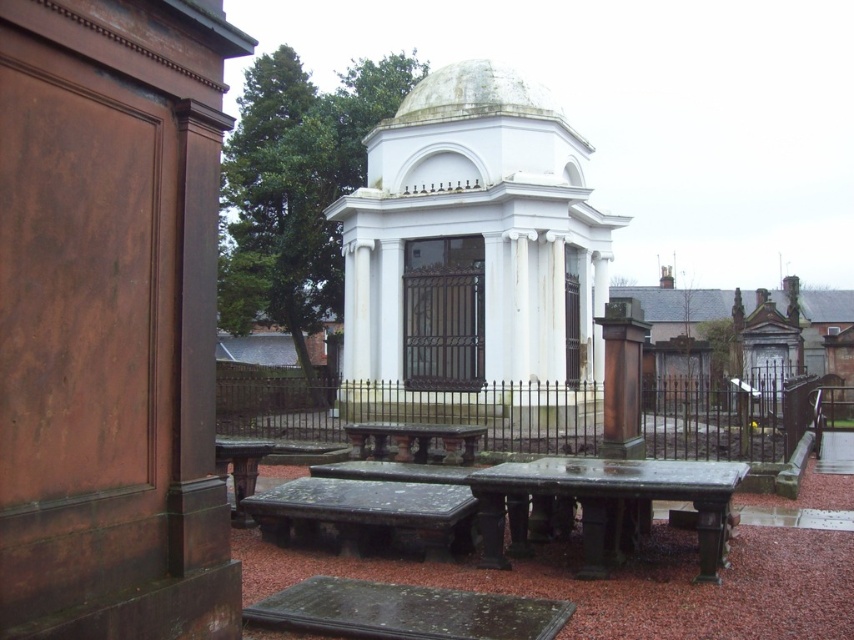
Question: Which of the following is the closest to the observer?

Choices:
 (A) (466, 550)
 (B) (416, 429)

Answer: (A)

Question: Does white marble chapel at center appear under smooth stone table at lower left?

Choices:
 (A) yes
 (B) no

Answer: (B)

Question: Which point is closer to the camera?

Choices:
 (A) (601, 259)
 (B) (264, 448)
 (C) (357, 529)
 (D) (648, 496)

Answer: (D)

Question: Does dark gray stone picnic table at center have a lesser width compared to polished stone bench at center?

Choices:
 (A) no
 (B) yes

Answer: (A)

Question: Can you confirm if polished stone bench at center is positioned to the right of polished stone table at center?

Choices:
 (A) no
 (B) yes

Answer: (B)

Question: Which point is farther to the camera?

Choices:
 (A) (238, 499)
 (B) (355, 548)

Answer: (A)